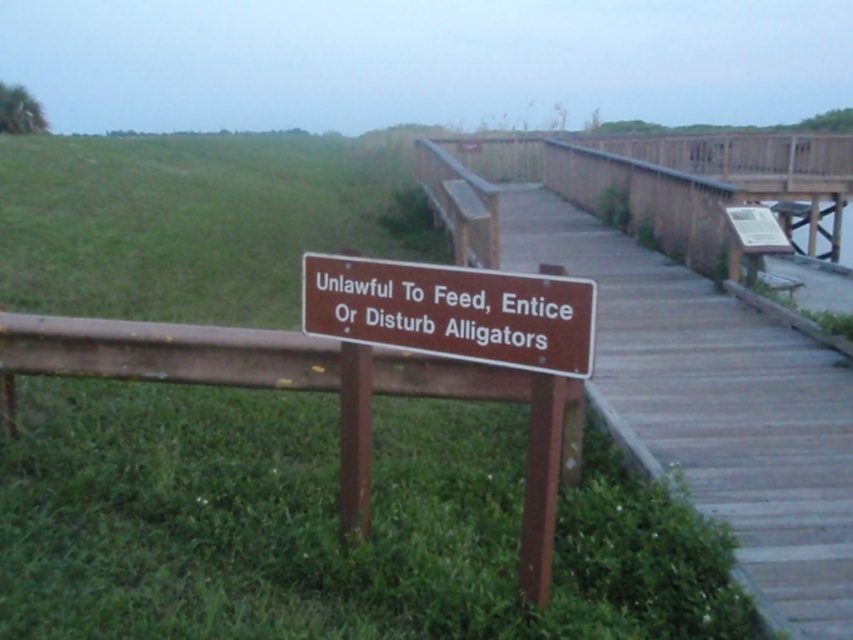
The width and height of the screenshot is (853, 640). In order to click on brown wooden sign at center in this screenshot , I will do `click(451, 310)`.

Does brown wooden sign at center appear over wooden bench at upper right?

No.

Between point (339, 326) and point (787, 292), which one is positioned behind?

Positioned behind is point (787, 292).

What are the coordinates of `brown wooden sign at center` in the screenshot? It's located at (451, 310).

Between point (724, 515) and point (416, 321), which one is positioned behind?

Positioned behind is point (724, 515).

Is brown wooden dock at center bigger than brown wooden sign at center?

Yes, brown wooden dock at center is bigger than brown wooden sign at center.

Measure the distance between point (740, 385) and camera.

A: They are 5.24 meters apart.

You are a GUI agent. You are given a task and a screenshot of the screen. Output one action in this format:
    pyautogui.click(x=<x>, y=<y>)
    Task: Click on the brown wooden dock at center
    The width and height of the screenshot is (853, 640).
    Given the screenshot: What is the action you would take?
    pyautogui.click(x=691, y=385)

Between brown wooden dock at center and wooden bench at upper right, which one appears on the left side from the viewer's perspective?

brown wooden dock at center

Who is more forward, (729, 326) or (753, 288)?

Positioned in front is point (729, 326).

At what (x,y) coordinates should I click in order to perform the action: click on brown wooden dock at center. Please return your answer as a coordinate pair (x, y). Looking at the image, I should click on (691, 385).